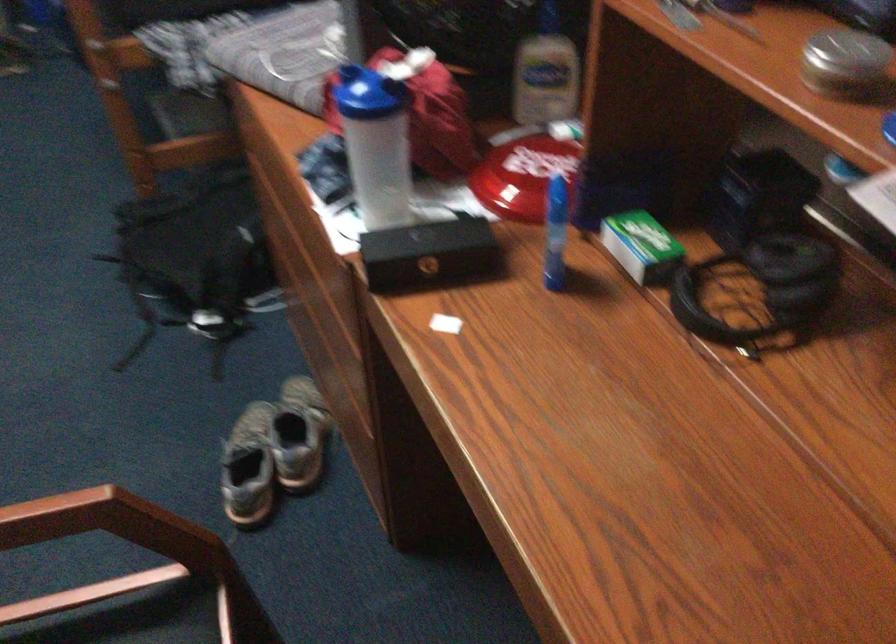
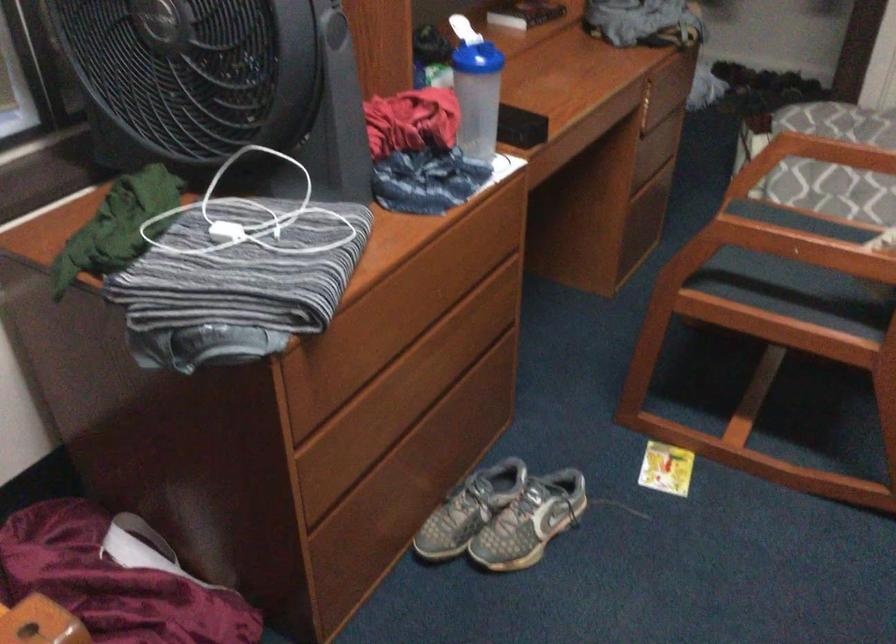
The point at (263, 421) is marked in the first image. Where is the corresponding point in the second image?

(503, 516)